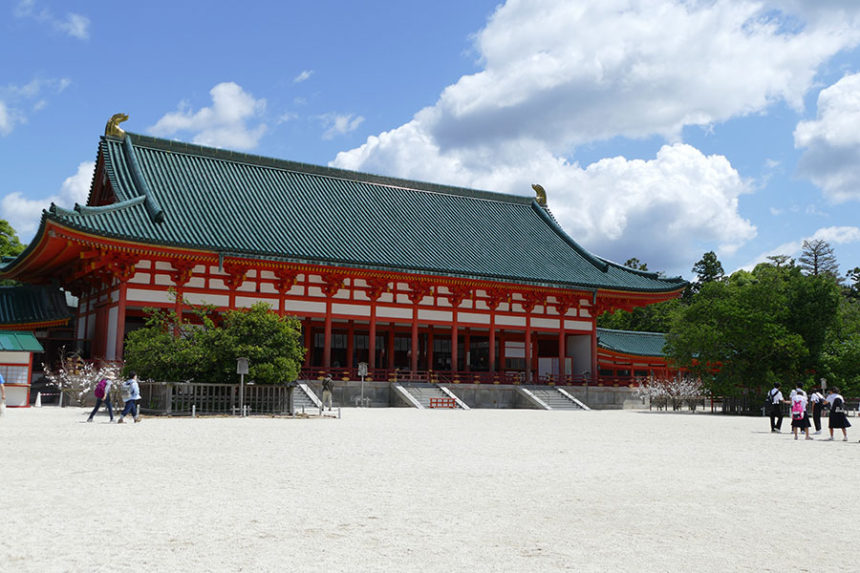
Locate an element on the screen. support column just inside building is located at coordinates (310, 341), (352, 346), (390, 351), (431, 353), (469, 356), (501, 361), (535, 354).